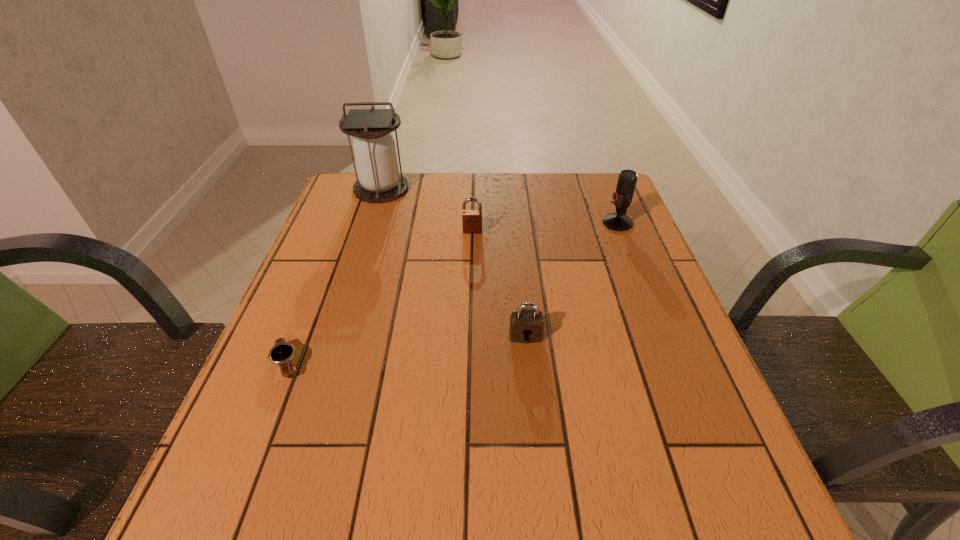
Image resolution: width=960 pixels, height=540 pixels. I want to click on watch present at the left edge, so click(282, 352).

Identify the location of object at the right edge. (618, 221).

Locate an element on the screen. object at the far left corner is located at coordinates (379, 181).

Find the location of a particular element. object at the far right corner is located at coordinates (618, 221).

Locate an element on the screen. The image size is (960, 540). vacant space at the far edge of the desktop is located at coordinates (456, 185).

The image size is (960, 540). In the image, there is a desktop. Find the location of `free space at the left edge`. free space at the left edge is located at coordinates (327, 252).

What are the coordinates of `vacant space at the right edge` in the screenshot? It's located at (685, 403).

Locate an element on the screen. Image resolution: width=960 pixels, height=540 pixels. vacant space at the far left corner of the desktop is located at coordinates (344, 191).

This screenshot has height=540, width=960. I want to click on vacant space at the far right corner of the desktop, so click(567, 187).

You are a GUI agent. You are given a task and a screenshot of the screen. Output one action in this format:
    pyautogui.click(x=<x>, y=<y>)
    Task: Click on the vacant space in between the third object from right to left and the shortest object
    The image size is (960, 540).
    Given the screenshot: What is the action you would take?
    pyautogui.click(x=379, y=297)